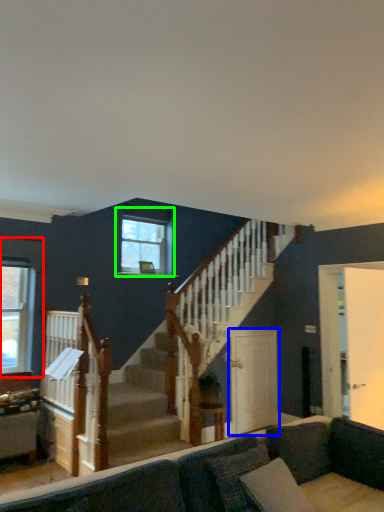
Question: Which object is positioned farthest from window (highlighted by a red box)? Select from screen door (highlighted by a blue box) and window (highlighted by a green box).

Choices:
 (A) screen door
 (B) window

Answer: (A)